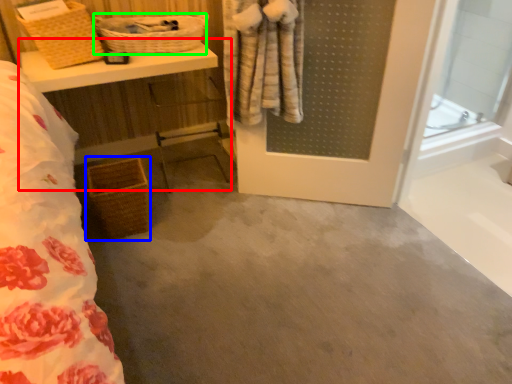
Question: Which is farther away from vanity (highlighted by a red box)? basket (highlighted by a blue box) or basket (highlighted by a green box)?

Choices:
 (A) basket
 (B) basket

Answer: (A)